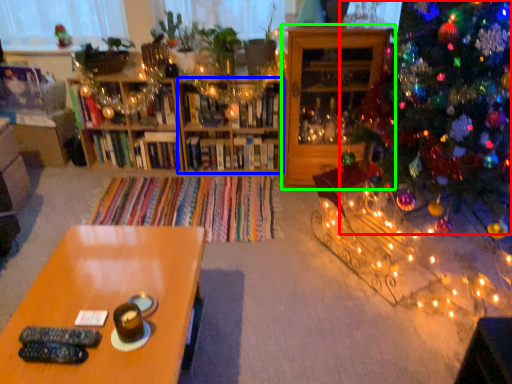
Question: Based on their relative distances, which object is farther from christmas tree (highlighted by a red box)? Choose from shelf (highlighted by a blue box) and shelf (highlighted by a green box).

Choices:
 (A) shelf
 (B) shelf

Answer: (A)